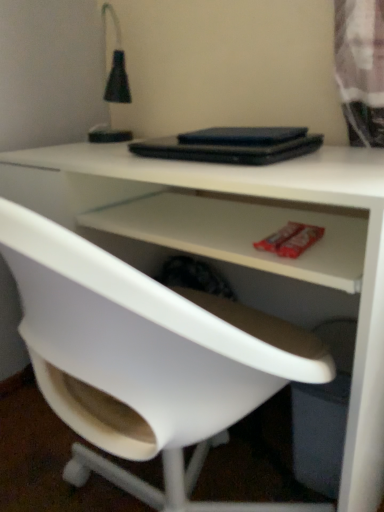
The image size is (384, 512). In order to click on free space to the left of black matte laptop at center in this screenshot , I will do `click(110, 156)`.